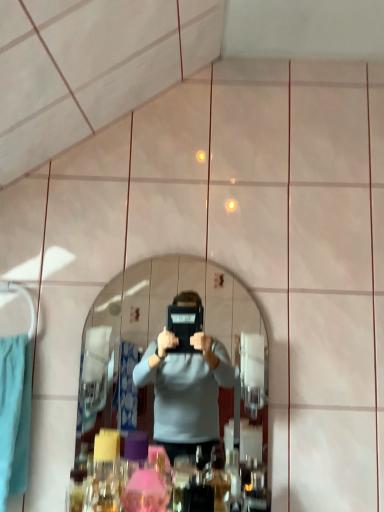
Question: From the image's perspective, is clear glass mirror at center over teal towel at left?

Choices:
 (A) yes
 (B) no

Answer: (A)

Question: From the image's perspective, does clear glass mirror at center appear lower than teal towel at left?

Choices:
 (A) no
 (B) yes

Answer: (A)

Question: Considering the relative sizes of clear glass mirror at center and teal towel at left in the image provided, is clear glass mirror at center wider than teal towel at left?

Choices:
 (A) yes
 (B) no

Answer: (B)

Question: Is clear glass mirror at center facing towards teal towel at left?

Choices:
 (A) no
 (B) yes

Answer: (A)

Question: From a real-world perspective, is clear glass mirror at center beneath teal towel at left?

Choices:
 (A) yes
 (B) no

Answer: (B)

Question: Is clear glass mirror at center bigger than teal towel at left?

Choices:
 (A) no
 (B) yes

Answer: (A)

Question: Is there a large distance between teal towel at left and clear glass mirror at center?

Choices:
 (A) no
 (B) yes

Answer: (B)

Question: Can you confirm if teal towel at left is taller than clear glass mirror at center?

Choices:
 (A) yes
 (B) no

Answer: (B)

Question: From a real-world perspective, does teal towel at left sit lower than clear glass mirror at center?

Choices:
 (A) yes
 (B) no

Answer: (A)

Question: From the image's perspective, is teal towel at left under clear glass mirror at center?

Choices:
 (A) yes
 (B) no

Answer: (A)

Question: Does teal towel at left come behind clear glass mirror at center?

Choices:
 (A) no
 (B) yes

Answer: (A)

Question: Does teal towel at left turn towards clear glass mirror at center?

Choices:
 (A) yes
 (B) no

Answer: (B)

Question: Does point (119, 406) appear closer or farther from the camera than point (13, 346)?

Choices:
 (A) closer
 (B) farther

Answer: (B)